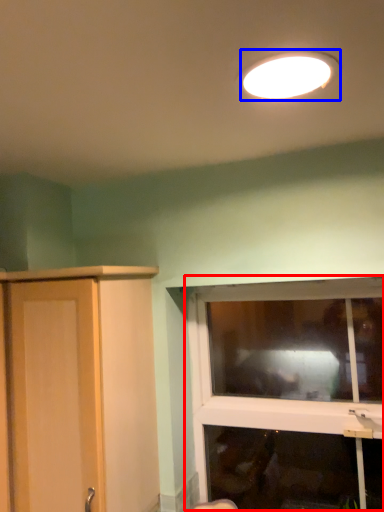
Question: Which object appears closest to the camera in this image, window (highlighted by a red box) or lamp (highlighted by a blue box)?

Choices:
 (A) window
 (B) lamp

Answer: (B)